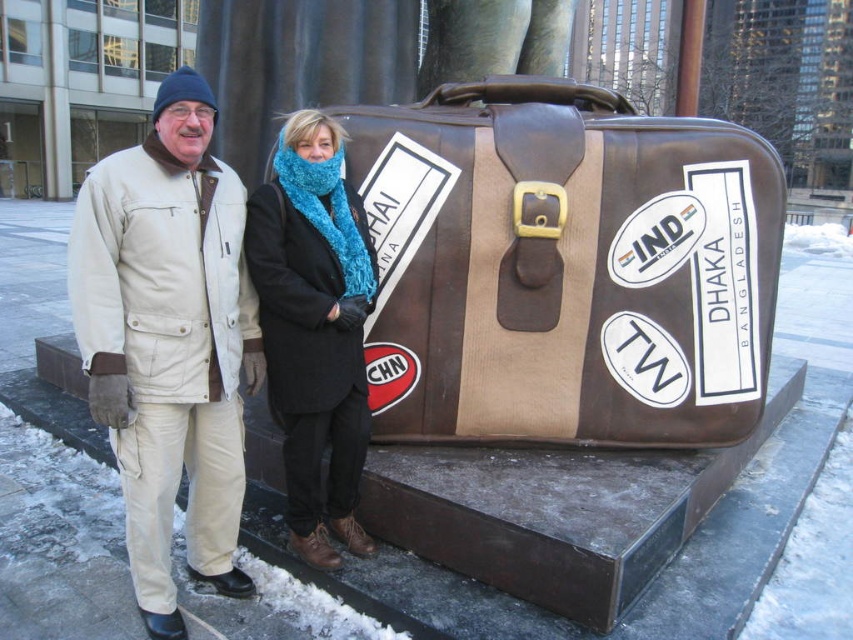
Question: Which point appears closest to the camera in this image?

Choices:
 (A) pos(349,205)
 (B) pos(163,209)
 (C) pos(450,172)

Answer: (B)

Question: Is brown leather suitcase at center below beige cotton jacket at left?

Choices:
 (A) no
 (B) yes

Answer: (A)

Question: Does brown leather suitcase at center appear under beige cotton jacket at left?

Choices:
 (A) no
 (B) yes

Answer: (A)

Question: Which of these objects is positioned farthest from the knitted blue scarf at center?

Choices:
 (A) brown leather suitcase at center
 (B) beige cotton jacket at left

Answer: (A)

Question: Estimate the real-world distances between objects in this image. Which object is closer to the beige cotton jacket at left?

Choices:
 (A) brown leather suitcase at center
 (B) knitted blue scarf at center

Answer: (B)

Question: Is beige cotton jacket at left above knitted blue scarf at center?

Choices:
 (A) yes
 (B) no

Answer: (B)